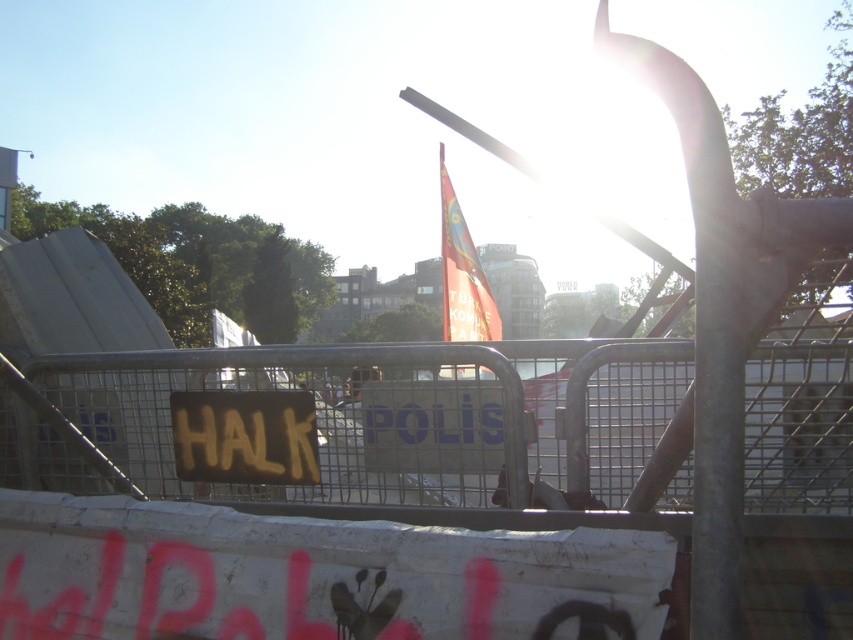
Question: Which object is farther from the camera taking this photo?

Choices:
 (A) red fabric flag at center
 (B) yellow painted sign at center

Answer: (B)

Question: Can you confirm if yellow painted sign at center is positioned to the right of red fabric flag at center?

Choices:
 (A) no
 (B) yes

Answer: (A)

Question: Where is yellow painted sign at center located in relation to red fabric flag at center in the image?

Choices:
 (A) right
 (B) left

Answer: (B)

Question: Which of the following is the closest to the observer?

Choices:
 (A) (402, 420)
 (B) (479, 273)

Answer: (A)

Question: Is yellow painted sign at center to the right of red fabric flag at center from the viewer's perspective?

Choices:
 (A) no
 (B) yes

Answer: (A)

Question: Estimate the real-world distances between objects in this image. Which object is farther from the red fabric flag at center?

Choices:
 (A) metallic silver fence at center
 (B) yellow painted sign at center

Answer: (A)